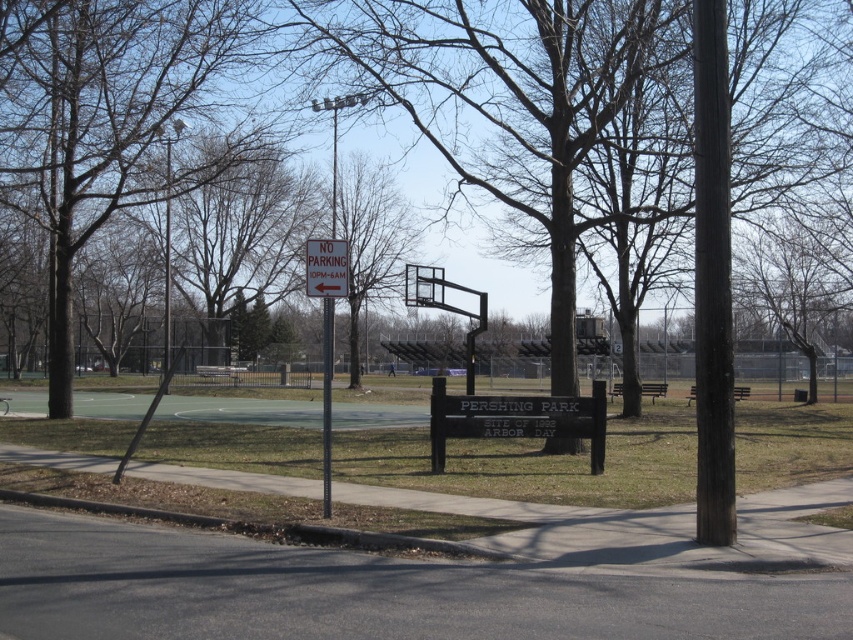
Does point (347, 170) come behind point (465, 356)?

No.

Between brown bark tree at center and black metal basketball hoop at center, which one appears on the left side from the viewer's perspective?

brown bark tree at center is more to the left.

This screenshot has width=853, height=640. What do you see at coordinates (370, 241) in the screenshot? I see `brown bark tree at center` at bounding box center [370, 241].

Locate an element on the screen. brown bark tree at center is located at coordinates (370, 241).

Who is shorter, brown wood tree at center or brown bark tree at center?

brown bark tree at center

Is brown wood tree at center thinner than brown bark tree at center?

Incorrect, brown wood tree at center's width is not less than brown bark tree at center's.

Which is behind, point (683, 74) or point (347, 264)?

The point (683, 74) is behind.

What are the coordinates of `brown wood tree at center` in the screenshot? It's located at (525, 100).

Between brown wood tree at center and white paper sign at center, which one has less height?

white paper sign at center is shorter.

Consider the image. Is brown wood tree at center to the right of white paper sign at center from the viewer's perspective?

Indeed, brown wood tree at center is positioned on the right side of white paper sign at center.

Does point (496, 1) lie in front of point (305, 252)?

No, (496, 1) is further to viewer.

Where is `brown wood tree at center`? The width and height of the screenshot is (853, 640). brown wood tree at center is located at coordinates (525, 100).